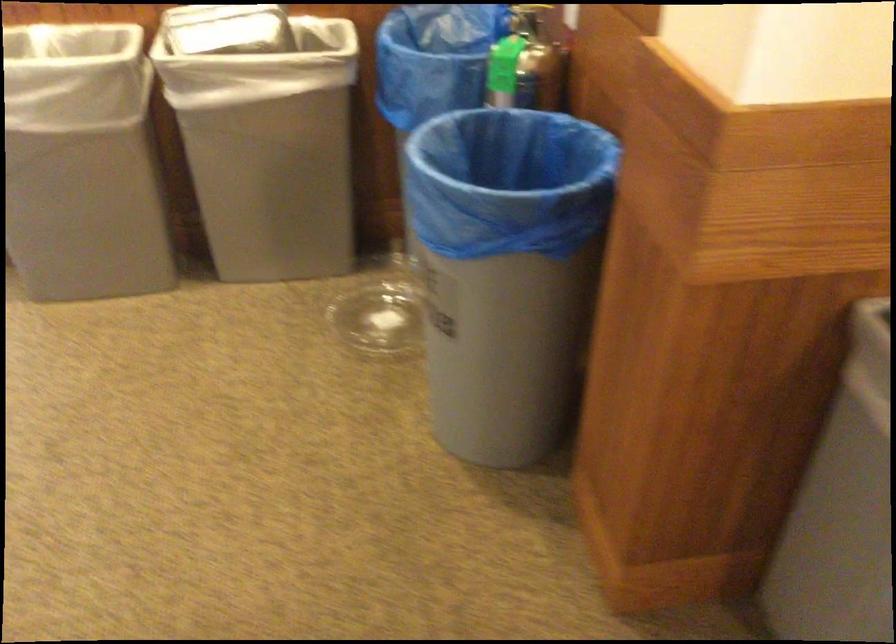
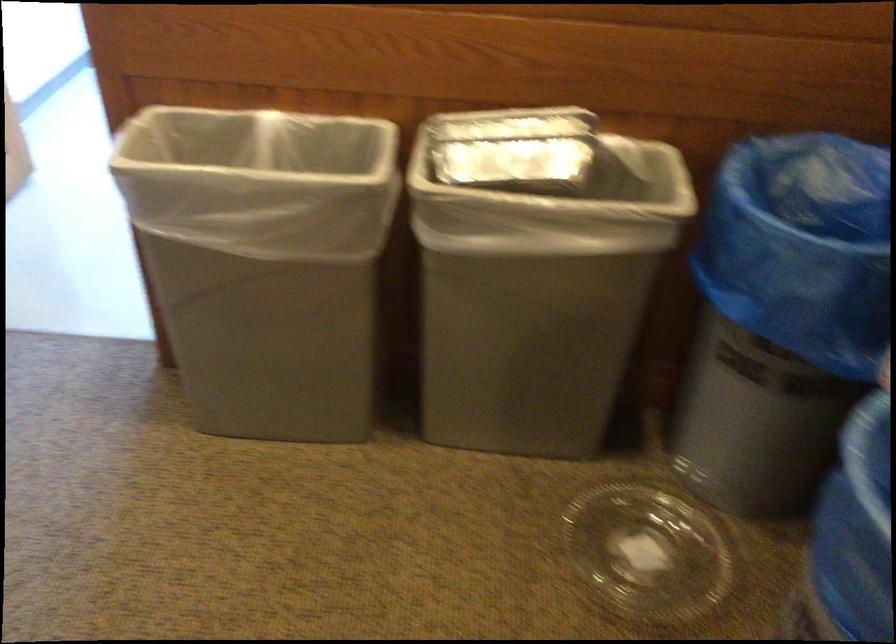
Locate, in the second image, the point that corresponds to (252,116) in the first image.

(533, 272)